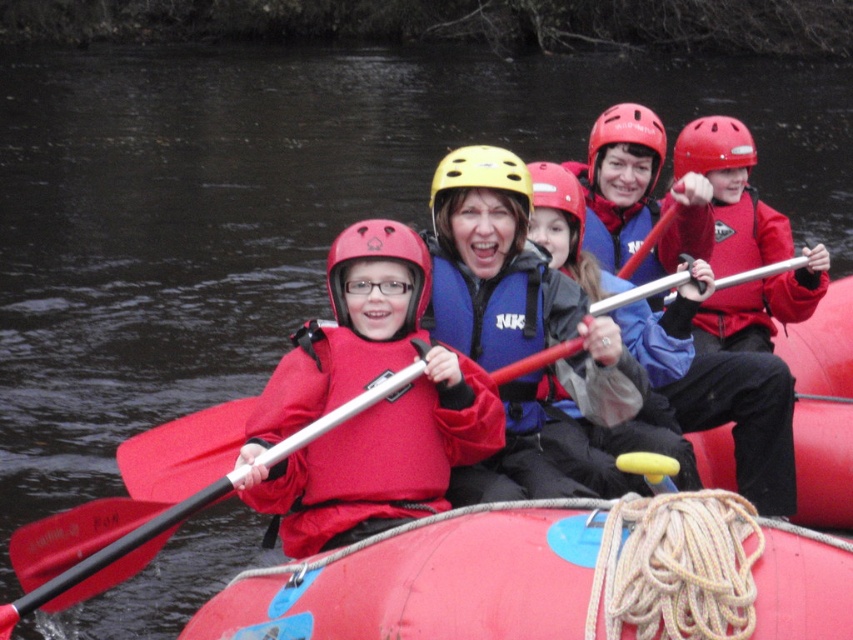
You are a safety inspector checking the gear of the rafting group. You notice the blue nylon life vest at center and the red matte helmet at upper right. Which item is larger in size?

The blue nylon life vest at center is smaller than the red matte helmet at upper right, so the red matte helmet at upper right is larger in size.